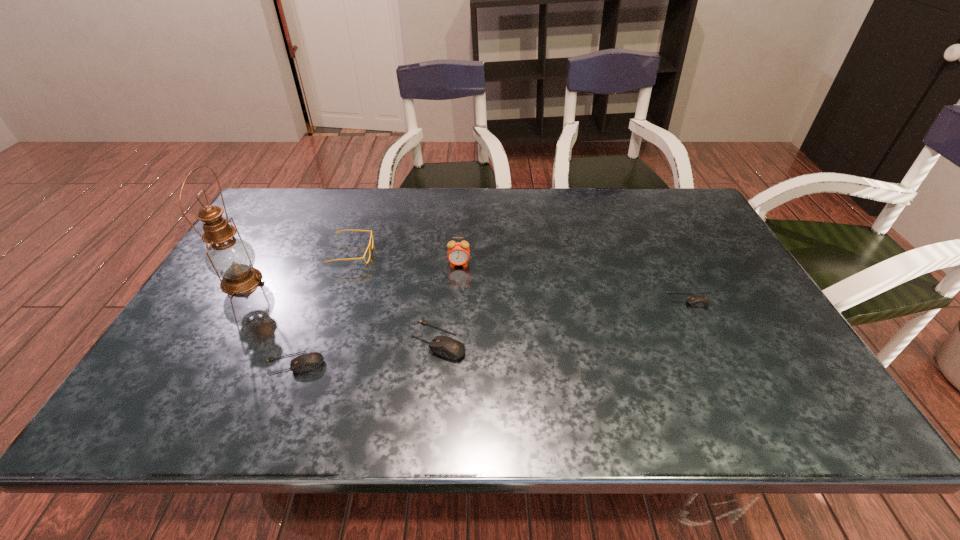
In the image, there is a desktop. Where is `vacant space at the left edge`? vacant space at the left edge is located at coordinates (194, 325).

Where is `free space at the right edge of the desktop`? free space at the right edge of the desktop is located at coordinates (702, 282).

The image size is (960, 540). In order to click on vacant area at the far left corner of the desktop in this screenshot , I will do `click(275, 196)`.

In the image, there is a desktop. Where is `free space at the near left corner`? free space at the near left corner is located at coordinates (237, 352).

Where is `vacant space in between the fifth shortest object and the rightmost mouse`? vacant space in between the fifth shortest object and the rightmost mouse is located at coordinates (573, 282).

This screenshot has height=540, width=960. I want to click on vacant area between the oil lamp and the second shortest object, so click(268, 322).

At what (x,y) coordinates should I click in order to perform the action: click on free space between the fourth tallest object and the shortest mouse. Please return your answer as a coordinate pair (x, y). Image resolution: width=960 pixels, height=540 pixels. Looking at the image, I should click on (564, 320).

Locate an element on the screen. free point between the spectacles and the rightmost object is located at coordinates coord(520,277).

What are the coordinates of `free area in between the spectacles and the alarm clock` in the screenshot? It's located at (405, 259).

Locate an element on the screen. Image resolution: width=960 pixels, height=540 pixels. free space between the second mouse from left to right and the fourth shortest object is located at coordinates (396, 297).